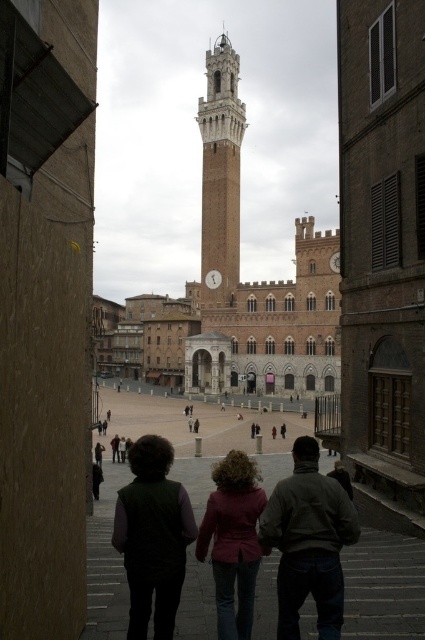
Who is more distant from viewer, (286, 483) or (209, 497)?

The point (209, 497) is behind.

In the scene shown: Is dark gray sweater at center in front of maroon fabric coat at center?

That is True.

Locate an element on the screen. The height and width of the screenshot is (640, 425). dark gray sweater at center is located at coordinates (308, 541).

Which is more to the right, maroon fabric coat at center or dark brown leather jacket at lower center?

Positioned to the right is dark brown leather jacket at lower center.

Does maroon fabric coat at center appear on the right side of dark brown leather jacket at lower center?

No, maroon fabric coat at center is not to the right of dark brown leather jacket at lower center.

Is point (223, 468) in front of point (346, 476)?

Yes.

Identify the location of maroon fabric coat at center. The width and height of the screenshot is (425, 640). (232, 540).

Between dark brown leather jacket at lower center and dark brown leather jacket at lower left, which one appears on the left side from the viewer's perspective?

From the viewer's perspective, dark brown leather jacket at lower left appears more on the left side.

Identify the location of dark brown leather jacket at lower center. This screenshot has width=425, height=640. (342, 477).

Is point (351, 486) closer to viewer compared to point (93, 476)?

Yes, it is.

Where is `dark brown leather jacket at lower center`? The image size is (425, 640). dark brown leather jacket at lower center is located at coordinates (342, 477).